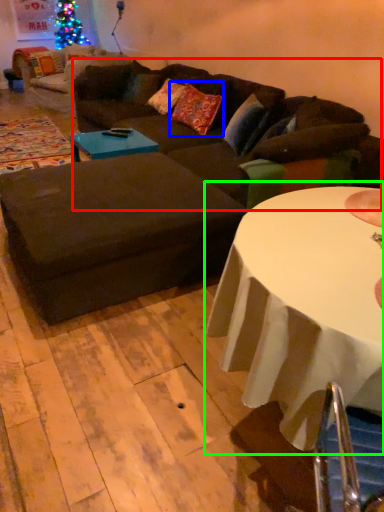
Question: Which object is positioned closest to couch (highlighted by a red box)? Select from pillow (highlighted by a blue box) and table (highlighted by a green box).

Choices:
 (A) pillow
 (B) table

Answer: (A)